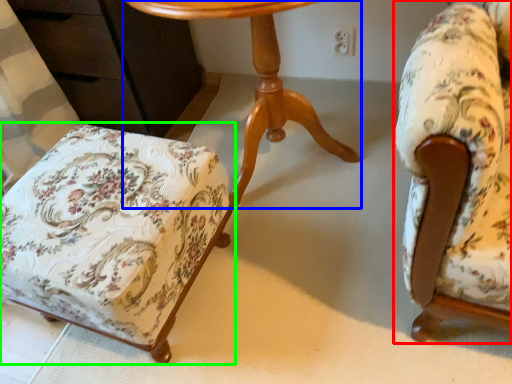
Question: Estimate the real-world distances between objects in this image. Which object is closer to chair (highlighted by a red box), table (highlighted by a blue box) or chair (highlighted by a green box)?

Choices:
 (A) table
 (B) chair

Answer: (A)